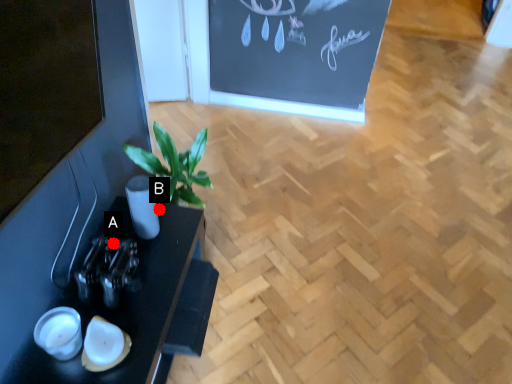
Question: Two points are circled on the image, labeled by A and B beside each circle. Which of the following is the closest to the observer?

Choices:
 (A) A is closer
 (B) B is closer

Answer: (A)